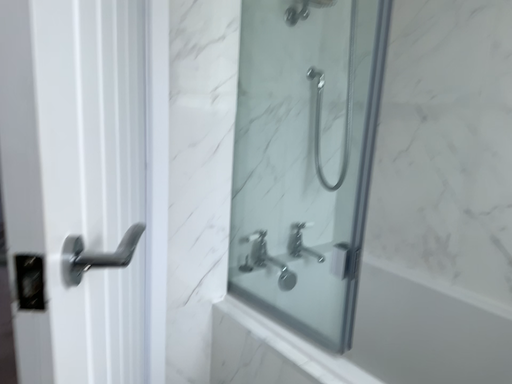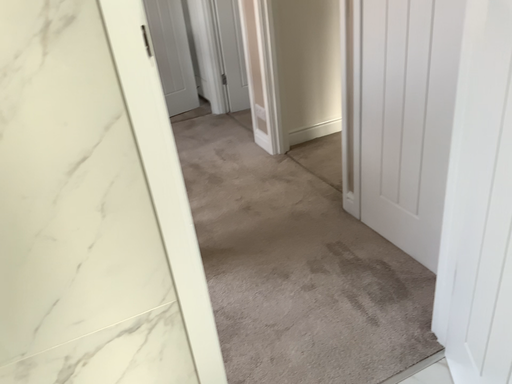
Question: How did the camera likely rotate when shooting the video?

Choices:
 (A) rotated upward
 (B) rotated downward

Answer: (B)